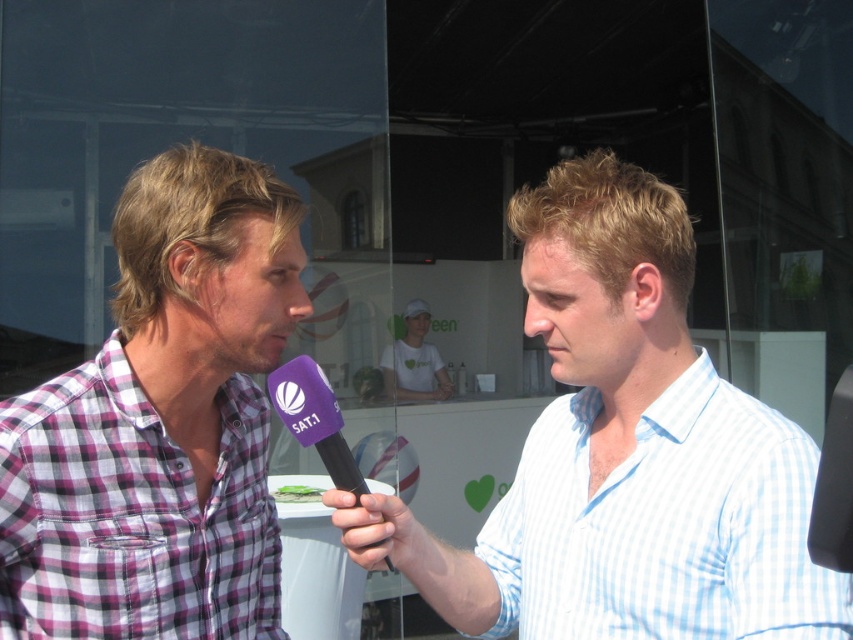
Which is more to the left, light blue striped shirt at right or white cotton t-shirt at center?

white cotton t-shirt at center

Based on the photo, does light blue striped shirt at right have a lesser height compared to white cotton t-shirt at center?

Indeed, light blue striped shirt at right has a lesser height compared to white cotton t-shirt at center.

Between point (677, 460) and point (428, 321), which one is positioned in front?

Point (677, 460)

This screenshot has height=640, width=853. Identify the location of light blue striped shirt at right. (664, 525).

Identify the location of light blue striped shirt at center. click(624, 454).

Is light blue striped shirt at center bigger than purple checkered shirt at left?

Yes.

Image resolution: width=853 pixels, height=640 pixels. What do you see at coordinates (624, 454) in the screenshot? I see `light blue striped shirt at center` at bounding box center [624, 454].

At what (x,y) coordinates should I click in order to perform the action: click on light blue striped shirt at center. Please return your answer as a coordinate pair (x, y). This screenshot has width=853, height=640. Looking at the image, I should click on (624, 454).

Who is lower down, light blue striped shirt at center or light blue striped shirt at right?

light blue striped shirt at right

Measure the distance between light blue striped shirt at center and camera.

light blue striped shirt at center and camera are 39.04 inches apart from each other.

Locate an element on the screen. The width and height of the screenshot is (853, 640). light blue striped shirt at center is located at coordinates (624, 454).